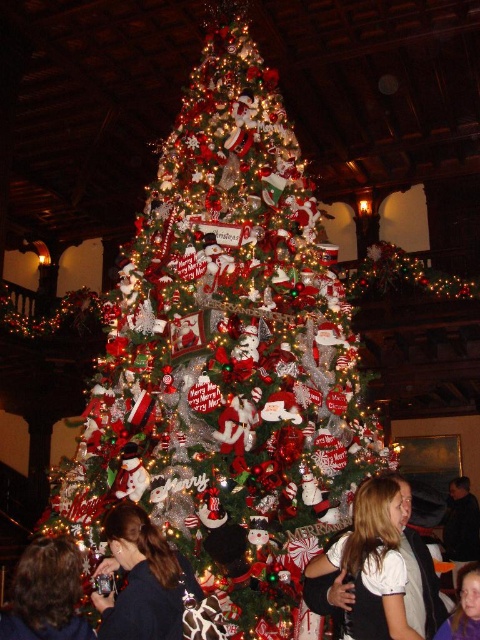
Does white cotton shirt at center appear under smooth skin face at lower right?

Actually, white cotton shirt at center is above smooth skin face at lower right.

Does white cotton shirt at center have a lesser width compared to smooth skin face at lower right?

Incorrect, white cotton shirt at center's width is not less than smooth skin face at lower right's.

Image resolution: width=480 pixels, height=640 pixels. Describe the element at coordinates (371, 564) in the screenshot. I see `white cotton shirt at center` at that location.

Find the location of a particular element. white cotton shirt at center is located at coordinates (371, 564).

Can you confirm if dark brown hair at lower left is smaller than dark blue shirt at lower right?

Correct, dark brown hair at lower left occupies less space than dark blue shirt at lower right.

Measure the distance between dark brown hair at lower left and dark blue shirt at lower right.

dark brown hair at lower left and dark blue shirt at lower right are 10.04 meters apart from each other.

Is point (14, 636) farther from viewer compared to point (460, 538)?

No, (14, 636) is in front of (460, 538).

Image resolution: width=480 pixels, height=640 pixels. Identify the location of dark brown hair at lower left. (46, 593).

Can you confirm if dark brown hair at lower left is shorter than smooth skin face at lower right?

In fact, dark brown hair at lower left may be taller than smooth skin face at lower right.

Is point (28, 586) behind point (472, 596)?

No, it is in front of (472, 596).

Where is `dark brown hair at lower left`? This screenshot has height=640, width=480. dark brown hair at lower left is located at coordinates (46, 593).